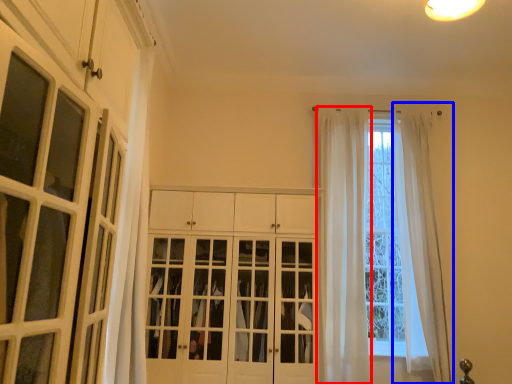
Question: Which object appears closest to the camera in this image, curtain (highlighted by a red box) or curtain (highlighted by a blue box)?

Choices:
 (A) curtain
 (B) curtain

Answer: (A)